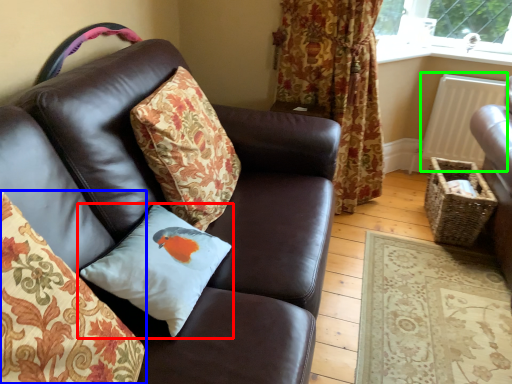
Question: Which object is positioned closest to pillow (highlighted by a red box)? Select from pillow (highlighted by a blue box) and radiator (highlighted by a green box).

Choices:
 (A) pillow
 (B) radiator

Answer: (A)